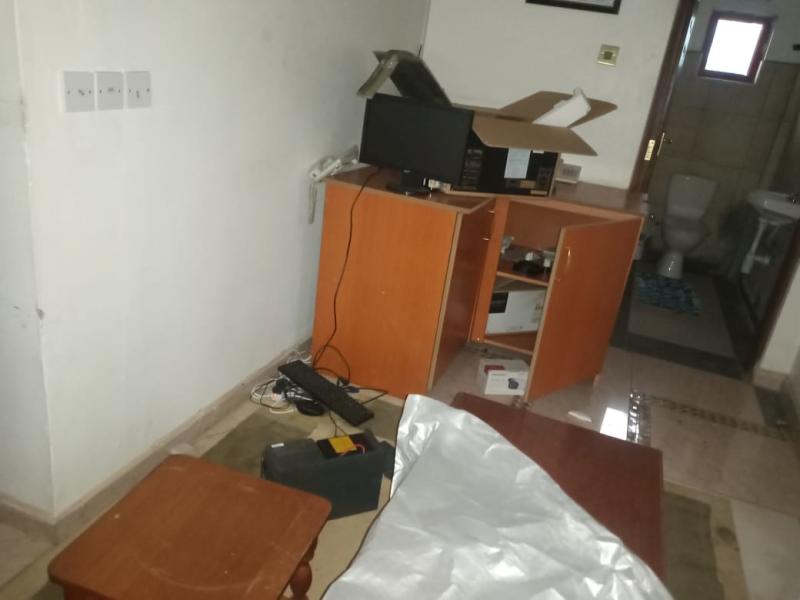
You are a GUI agent. You are given a task and a screenshot of the screen. Output one action in this format:
    pyautogui.click(x=<x>, y=<y>)
    Task: Click on the box
    
    Given the screenshot: What is the action you would take?
    pyautogui.click(x=453, y=131)